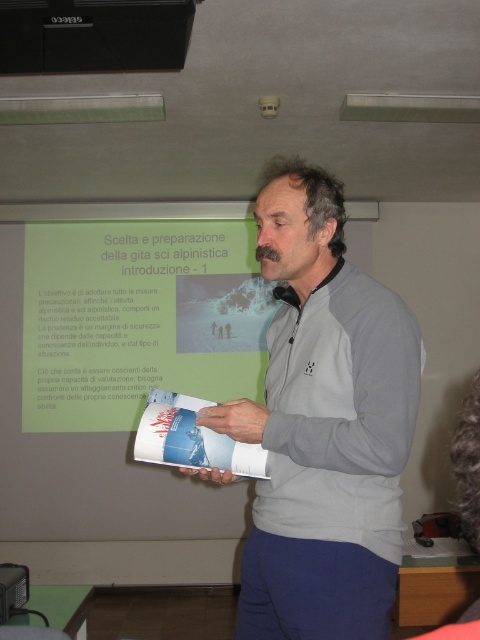
You are a photographer standing at the origin of the coordinate system in the image. You want to take a photo of the point at point (372, 595) and point (143, 22). Which point is closer to you?

Point (372, 595) is in front of point (143, 22), so it is closer to you.

What are the coordinates of the gray fleece jacket at center?

The gray fleece jacket at center is located at coordinates point (x=324, y=426).